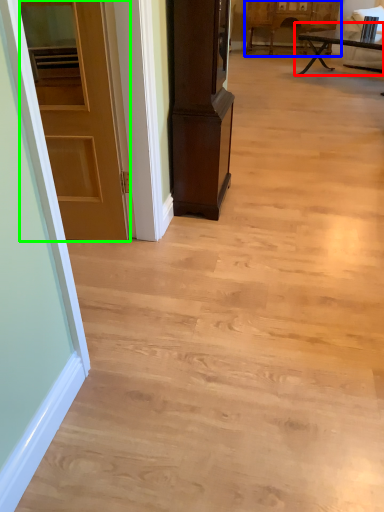
Question: Which object is positioned farthest from table (highlighted by a red box)? Select from cabinetry (highlighted by a blue box) and door (highlighted by a green box).

Choices:
 (A) cabinetry
 (B) door

Answer: (B)